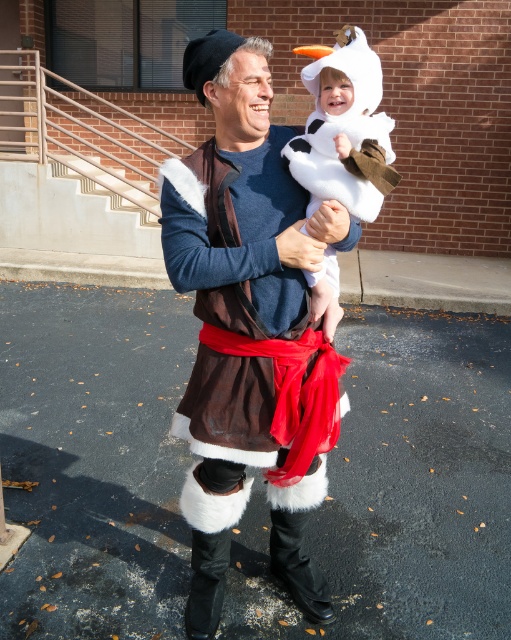
Question: Is fuzzy brown vest at center positioned behind white fluffy costume at center?

Choices:
 (A) yes
 (B) no

Answer: (B)

Question: Which object appears farthest from the camera in this image?

Choices:
 (A) white fluffy costume at center
 (B) fuzzy brown vest at center

Answer: (A)

Question: Can you confirm if fuzzy brown vest at center is bigger than white fluffy costume at center?

Choices:
 (A) no
 (B) yes

Answer: (B)

Question: Is fuzzy brown vest at center to the left of white fluffy costume at center from the viewer's perspective?

Choices:
 (A) yes
 (B) no

Answer: (A)